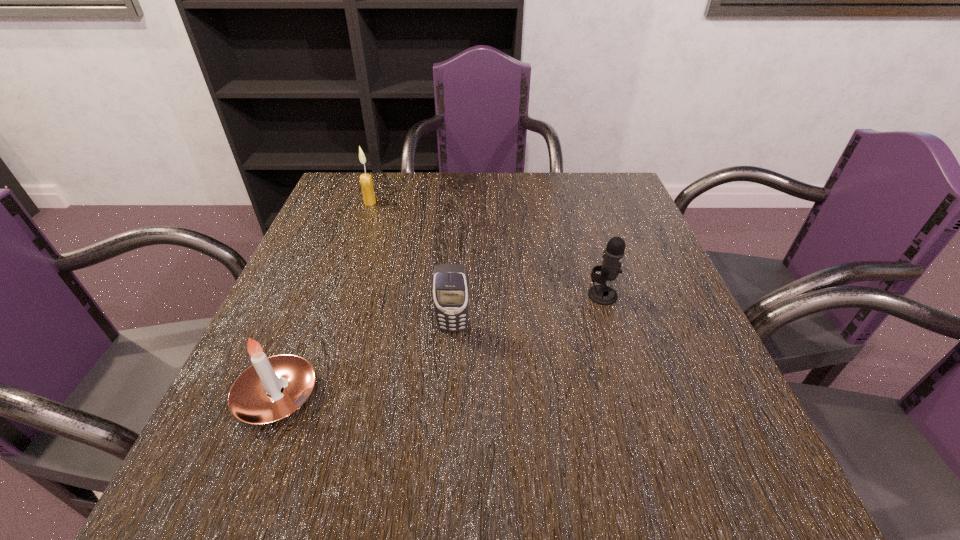
Locate which object is the second closest to the cellular telephone. Please provide its 2D coordinates. Your answer should be formatted as a tuple, i.e. [(x, y)], where the tuple contains the x and y coordinates of a point satisfying the conditions above.

[(602, 294)]